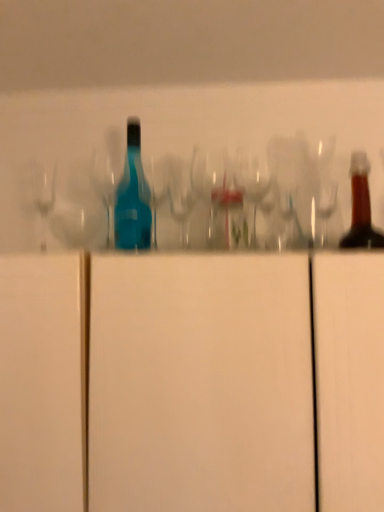
Image resolution: width=384 pixels, height=512 pixels. What do you see at coordinates (252, 180) in the screenshot? I see `clear glass wine glass at center` at bounding box center [252, 180].

Image resolution: width=384 pixels, height=512 pixels. What do you see at coordinates (200, 384) in the screenshot?
I see `white matte cabinet at center` at bounding box center [200, 384].

Where is `transparent glass shot glass at center`? This screenshot has width=384, height=512. transparent glass shot glass at center is located at coordinates (77, 209).

From the image's perspective, which is above, clear glass wine glass at center or white matte cabinet at center?

From the image's view, clear glass wine glass at center is above.

Can you tell me how much clear glass wine glass at center and white matte cabinet at center differ in facing direction?

The facing directions of clear glass wine glass at center and white matte cabinet at center are 0.000618 degrees apart.

Is clear glass wine glass at center surrounding white matte cabinet at center?

No, white matte cabinet at center is not a part of clear glass wine glass at center.

Is clear glass wine glass at center aimed at white matte cabinet at center?

No, clear glass wine glass at center does not turn towards white matte cabinet at center.

Where is `cabinetry in front of the transparent glass shot glass at center`? The width and height of the screenshot is (384, 512). cabinetry in front of the transparent glass shot glass at center is located at coordinates (200, 384).

Considering the sizes of white matte cabinet at center and transparent glass shot glass at center in the image, is white matte cabinet at center taller or shorter than transparent glass shot glass at center?

Considering their sizes, white matte cabinet at center has more height than transparent glass shot glass at center.

From a real-world perspective, relative to transparent glass shot glass at center, is white matte cabinet at center vertically above or below?

From a real-world perspective, white matte cabinet at center is physically below transparent glass shot glass at center.

Could you tell me if white matte cabinet at center is facing transparent glass shot glass at center?

No, white matte cabinet at center is not oriented towards transparent glass shot glass at center.

Locate an element on the screen. The width and height of the screenshot is (384, 512). shot glass above the white matte cabinet at center (from the image's perspective) is located at coordinates (77, 209).

From a real-world perspective, which is physically below, transparent glass shot glass at center or white matte cabinet at center?

In real-world perspective, white matte cabinet at center is lower.

Considering the sizes of objects transparent glass shot glass at center and white matte cabinet at center in the image provided, who is wider, transparent glass shot glass at center or white matte cabinet at center?

With larger width is white matte cabinet at center.

Based on the photo, from the image's perspective, is transparent glass shot glass at center above or below white matte cabinet at center?

Clearly, from the image's perspective, transparent glass shot glass at center is above white matte cabinet at center.

Is transparent glass shot glass at center positioned behind clear glass wine glass at center?

Yes, it is behind clear glass wine glass at center.

Which object is positioned more to the left, transparent glass shot glass at center or clear glass wine glass at center?

transparent glass shot glass at center is more to the left.

From a real-world perspective, who is located higher, transparent glass shot glass at center or clear glass wine glass at center?

transparent glass shot glass at center, from a real-world perspective.

Is transparent glass shot glass at center oriented away from clear glass wine glass at center?

No, clear glass wine glass at center is not at the back of transparent glass shot glass at center.

From a real-world perspective, is white matte cabinet at center positioned above or below clear glass wine glass at center?

Clearly, from a real-world perspective, white matte cabinet at center is below clear glass wine glass at center.

Which is closer to the camera, (383, 328) or (265, 176)?

Positioned in front is point (383, 328).

Which object is positioned more to the left, white matte cabinet at center or clear glass wine glass at center?

Positioned to the left is white matte cabinet at center.

How distant is clear glass wine glass at center from transparent glass shot glass at center?

clear glass wine glass at center is 16.23 inches from transparent glass shot glass at center.

Considering the sizes of clear glass wine glass at center and transparent glass shot glass at center in the image, is clear glass wine glass at center wider or thinner than transparent glass shot glass at center?

Considering their sizes, clear glass wine glass at center looks slimmer than transparent glass shot glass at center.

Is point (244, 180) positioned after point (52, 228)?

No.

Is clear glass wine glass at center not near transparent glass shot glass at center?

clear glass wine glass at center is actually quite close to transparent glass shot glass at center.

The width and height of the screenshot is (384, 512). I want to click on cabinetry in front of the clear glass wine glass at center, so click(200, 384).

Where is `shot glass located above the white matte cabinet at center (from the image's perspective)`? shot glass located above the white matte cabinet at center (from the image's perspective) is located at coordinates (77, 209).

Which object lies further to the anchor point clear glass wine glass at center, transparent glass shot glass at center or white matte cabinet at center?

white matte cabinet at center lies further to clear glass wine glass at center than the other object.

When comparing their distances from white matte cabinet at center, does transparent glass shot glass at center or clear glass wine glass at center seem further?

transparent glass shot glass at center is positioned further to the anchor white matte cabinet at center.

Considering their positions, is white matte cabinet at center positioned further to transparent glass shot glass at center than clear glass wine glass at center?

white matte cabinet at center is further to transparent glass shot glass at center.

From the picture: Which object lies nearer to the anchor point white matte cabinet at center, clear glass wine glass at center or transparent glass shot glass at center?

Based on the image, clear glass wine glass at center appears to be nearer to white matte cabinet at center.

Based on their spatial positions, is white matte cabinet at center or transparent glass shot glass at center closer to clear glass wine glass at center?

transparent glass shot glass at center lies closer to clear glass wine glass at center than the other object.

Based on their spatial positions, is clear glass wine glass at center or white matte cabinet at center further from transparent glass shot glass at center?

Among the two, white matte cabinet at center is located further to transparent glass shot glass at center.

Find the location of `wine glass that lies between transparent glass shot glass at center and white matte cabinet at center from top to bottom`. wine glass that lies between transparent glass shot glass at center and white matte cabinet at center from top to bottom is located at coordinates (252, 180).